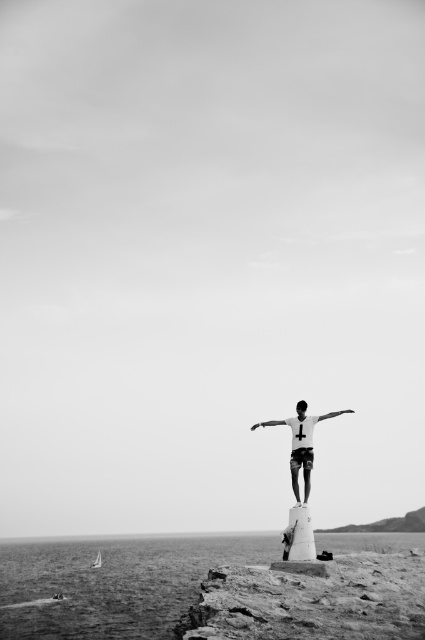
Does point (99, 609) come farther from viewer compared to point (261, 422)?

That is True.

Does point (175, 592) lie in front of point (275, 424)?

No.

The width and height of the screenshot is (425, 640). In order to click on smooth water at lower left in this screenshot , I will do `click(113, 582)`.

Is smooth metallic arm at center bigger than white matte arm at center?

Correct, smooth metallic arm at center is larger in size than white matte arm at center.

From the picture: Can you confirm if smooth metallic arm at center is wider than white matte arm at center?

No, smooth metallic arm at center is not wider than white matte arm at center.

What are the coordinates of `smooth metallic arm at center` in the screenshot? It's located at (269, 422).

Where is `smooth metallic arm at center`? The width and height of the screenshot is (425, 640). smooth metallic arm at center is located at coordinates (269, 422).

Which of these two, smooth water at lower left or white matte shirt at center, stands shorter?

Standing shorter between the two is white matte shirt at center.

Is smooth water at lower left above white matte shirt at center?

Actually, smooth water at lower left is below white matte shirt at center.

This screenshot has width=425, height=640. Identify the location of smooth water at lower left. coord(113,582).